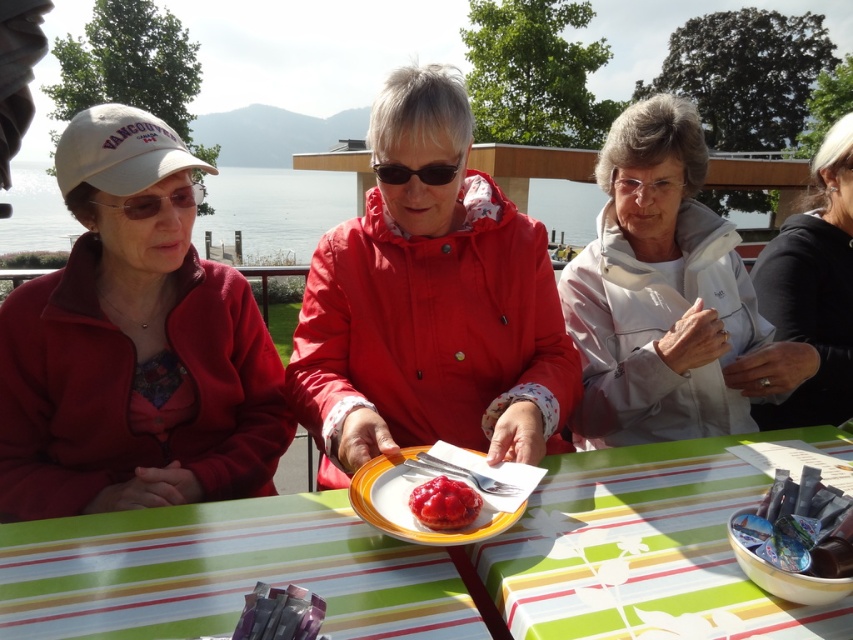
Consider the image. You are standing in front of the table where the group is seated. You want to place a gift box that is 3 feet wide on the table between the matte red jacket at center and the edge of the table closest to you. Is there enough space?

The distance between the matte red jacket at center and the viewer is 3.29 feet. Since the gift box is 3 feet wide, there is enough space to place it between the matte red jacket at center and the edge of the table closest to you.

From the picture: You are sitting at the table in the image and want to reach a snack placed at point (258, 189). Is this point closer to you than point (433, 502)?

Point (258, 189) is behind point (433, 502), so it is farther away from you. Therefore, the snack at point (258, 189) is not closer to you than point (433, 502).

You are a photographer taking a picture of the clear blue water at upper center and the glossy red jam tart at center. Which object should you adjust your camera to focus on first if you want to capture both in sharp detail?

The clear blue water at upper center should be focused on first because it is positioned to the left of the glossy red jam tart at center, so adjusting focus starting from the left ensures both are in sharp detail.